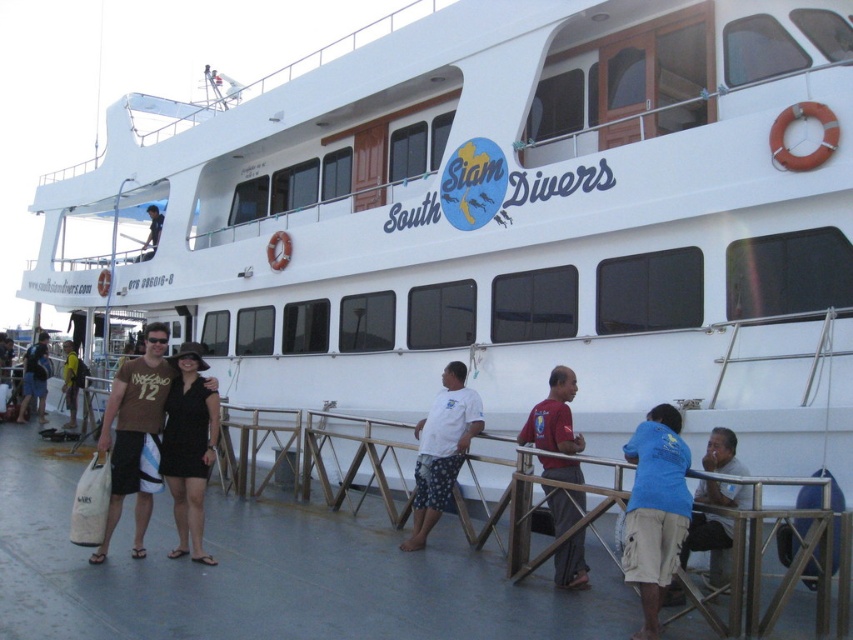
You are standing on the pier looking at the South Siam Divers boat. You notice the blue cotton shirt at lower right and the white matte deck at center. Which object is closer to you?

The blue cotton shirt at lower right is behind the white matte deck at center, so the white matte deck at center is closer to you.

You are a photographer on the pier taking pictures of the South Siam Divers boat. You notice a black fabric dress at lower left and a white cotton shirt at center. Which clothing item is closer to the camera?

The black fabric dress at lower left is closer to the camera because it is in front of the white cotton shirt at center.

From the picture: You are a photographer taking a picture of the South Siam Divers boat. You notice a black fabric dress at lower left and a brown fabric bag at lower left in the frame. Which object would you need to adjust less in your composition to make more space for the boat?

The black fabric dress at lower left occupies less space than the brown fabric bag at lower left, so you would need to adjust the brown fabric bag at lower left less to make more space for the boat.